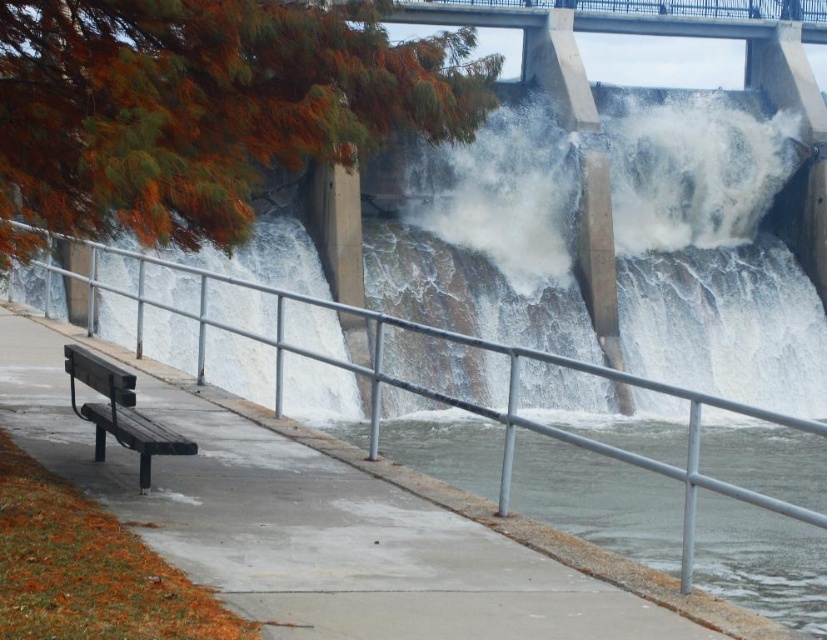
Does clear concrete water at lower center appear over wooden bench at left?

Actually, clear concrete water at lower center is below wooden bench at left.

Does clear concrete water at lower center appear under wooden bench at left?

Correct, clear concrete water at lower center is located below wooden bench at left.

This screenshot has width=827, height=640. Identify the location of clear concrete water at lower center. click(600, 499).

Looking at this image, does metal/smooth rail at left have a lesser height compared to wooden bench at left?

No, metal/smooth rail at left is not shorter than wooden bench at left.

Who is lower down, metal/smooth rail at left or wooden bench at left?

metal/smooth rail at left is lower down.

The width and height of the screenshot is (827, 640). In order to click on metal/smooth rail at left in this screenshot , I will do `click(450, 394)`.

Is point (773, 445) behind point (649, 385)?

Yes, point (773, 445) is farther from viewer.

In the scene shown: How far apart are clear concrete water at lower center and metal/smooth rail at left?

clear concrete water at lower center and metal/smooth rail at left are 1.86 meters apart.

I want to click on clear concrete water at lower center, so click(600, 499).

What are the coordinates of `clear concrete water at lower center` in the screenshot? It's located at (600, 499).